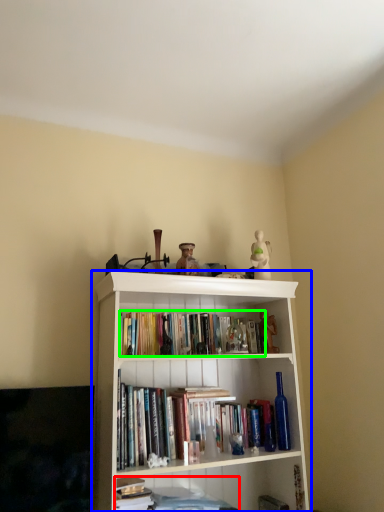
Question: Considering the real-world distances, which object is farthest from book (highlighted by a red box)? bookcase (highlighted by a blue box) or book (highlighted by a green box)?

Choices:
 (A) bookcase
 (B) book

Answer: (B)